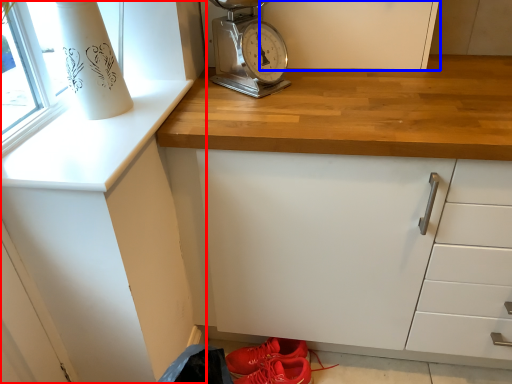
Question: Among these objects, which one is farthest to the camera, cabinetry (highlighted by a red box) or cabinetry (highlighted by a blue box)?

Choices:
 (A) cabinetry
 (B) cabinetry

Answer: (B)